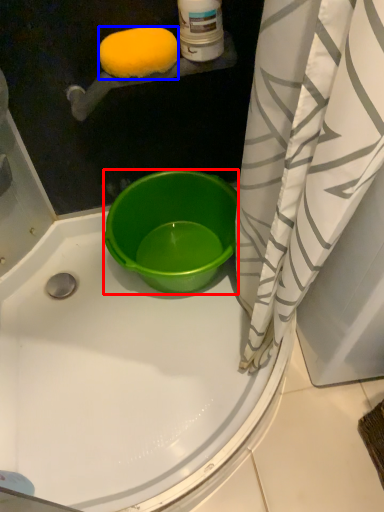
Question: Which of the following is the farthest to the observer, bucket (highlighted by a red box) or lemon (highlighted by a blue box)?

Choices:
 (A) bucket
 (B) lemon

Answer: (A)